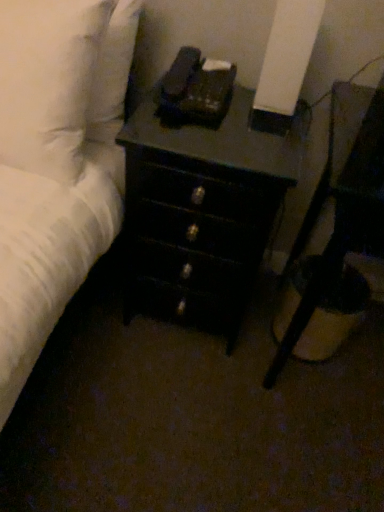
Question: Are white soft pillow at upper left and black glossy nightstand at lower right located far from each other?

Choices:
 (A) yes
 (B) no

Answer: (B)

Question: Does white soft pillow at upper left have a lesser width compared to black glossy nightstand at lower right?

Choices:
 (A) no
 (B) yes

Answer: (B)

Question: Considering the relative sizes of white soft pillow at upper left and black glossy nightstand at lower right in the image provided, is white soft pillow at upper left smaller than black glossy nightstand at lower right?

Choices:
 (A) no
 (B) yes

Answer: (B)

Question: Is white soft pillow at upper left positioned behind black glossy nightstand at lower right?

Choices:
 (A) no
 (B) yes

Answer: (B)

Question: Does white soft pillow at upper left have a greater width compared to black glossy nightstand at lower right?

Choices:
 (A) yes
 (B) no

Answer: (B)

Question: From the image's perspective, is white soft pillow at upper left on top of black glossy nightstand at lower right?

Choices:
 (A) yes
 (B) no

Answer: (A)

Question: From a real-world perspective, is white soft pillow at upper left positioned under black wood chest of drawers at center based on gravity?

Choices:
 (A) yes
 (B) no

Answer: (B)

Question: Would you say white soft pillow at upper left is a long distance from black wood chest of drawers at center?

Choices:
 (A) yes
 (B) no

Answer: (B)

Question: Considering the relative positions of white soft pillow at upper left and black wood chest of drawers at center in the image provided, is white soft pillow at upper left to the left of black wood chest of drawers at center from the viewer's perspective?

Choices:
 (A) yes
 (B) no

Answer: (A)

Question: From the image's perspective, is white soft pillow at upper left on top of black wood chest of drawers at center?

Choices:
 (A) yes
 (B) no

Answer: (A)

Question: Is white soft pillow at upper left not inside black wood chest of drawers at center?

Choices:
 (A) yes
 (B) no

Answer: (A)

Question: Can you confirm if white soft pillow at upper left is smaller than black wood chest of drawers at center?

Choices:
 (A) no
 (B) yes

Answer: (B)

Question: Is black glossy nightstand at lower right to the left of white soft pillow at upper left from the viewer's perspective?

Choices:
 (A) yes
 (B) no

Answer: (B)